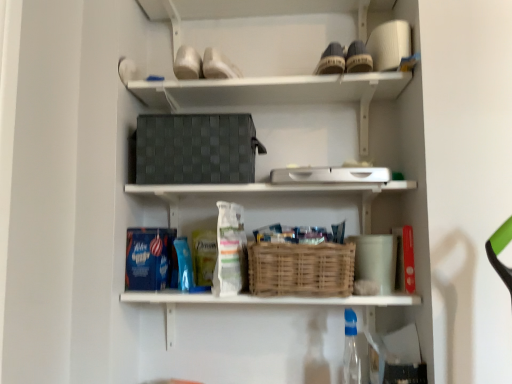
Question: Is dark gray woven basket at upper center, which is the second shelf from bottom to top, outside matte brown shoe at upper center?

Choices:
 (A) no
 (B) yes

Answer: (B)

Question: Is dark gray woven basket at upper center, which is the second shelf from bottom to top, to the left of matte brown shoe at upper center from the viewer's perspective?

Choices:
 (A) yes
 (B) no

Answer: (A)

Question: From the image's perspective, would you say dark gray woven basket at upper center, which is the second shelf from bottom to top, is positioned over matte brown shoe at upper center?

Choices:
 (A) no
 (B) yes

Answer: (A)

Question: Is dark gray woven basket at upper center, which is the second shelf from bottom to top, bigger than matte brown shoe at upper center?

Choices:
 (A) yes
 (B) no

Answer: (A)

Question: Is dark gray woven basket at upper center, which is the second shelf from bottom to top, aimed at matte brown shoe at upper center?

Choices:
 (A) no
 (B) yes

Answer: (A)

Question: Considering the relative sizes of dark gray woven basket at upper center, the first shelf viewed from the top, and woven wicker basket at center, the 1th shelf from the bottom, in the image provided, is dark gray woven basket at upper center, the first shelf viewed from the top, bigger than woven wicker basket at center, the 1th shelf from the bottom,?

Choices:
 (A) no
 (B) yes

Answer: (B)

Question: From the image's perspective, would you say dark gray woven basket at upper center, which is the second shelf from bottom to top, is shown under woven wicker basket at center, which is the second shelf in top-to-bottom order?

Choices:
 (A) yes
 (B) no

Answer: (B)

Question: Is the position of dark gray woven basket at upper center, which is the second shelf from bottom to top, less distant than that of woven wicker basket at center, which is the second shelf in top-to-bottom order?

Choices:
 (A) no
 (B) yes

Answer: (A)

Question: From a real-world perspective, is dark gray woven basket at upper center, which is the second shelf from bottom to top, over woven wicker basket at center, the 1th shelf from the bottom?

Choices:
 (A) no
 (B) yes

Answer: (B)

Question: Considering the relative sizes of dark gray woven basket at upper center, the first shelf viewed from the top, and woven wicker basket at center, the 1th shelf from the bottom, in the image provided, is dark gray woven basket at upper center, the first shelf viewed from the top, smaller than woven wicker basket at center, the 1th shelf from the bottom,?

Choices:
 (A) yes
 (B) no

Answer: (B)

Question: Is dark gray woven basket at upper center, which is the second shelf from bottom to top, positioned with its back to woven wicker basket at center, which is the second shelf in top-to-bottom order?

Choices:
 (A) yes
 (B) no

Answer: (B)

Question: Is dark gray woven basket at upper center, the first shelf viewed from the top, facing away from transparent plastic bottle at lower center?

Choices:
 (A) yes
 (B) no

Answer: (B)